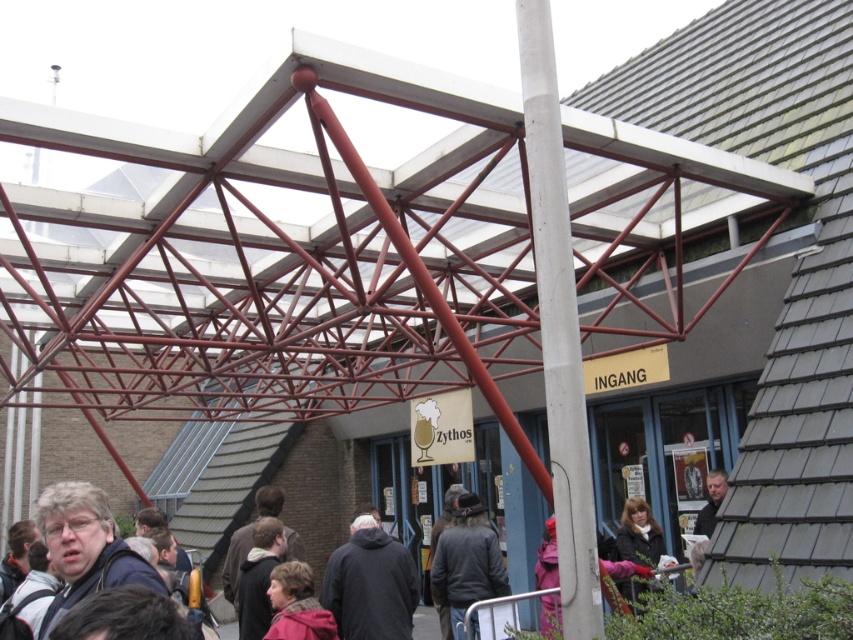
Question: Which point is closer to the camera taking this photo?

Choices:
 (A) coord(352,624)
 (B) coord(281,563)

Answer: (A)

Question: Is dark gray hoodie at center closer to camera compared to dark brown leather jacket at center?

Choices:
 (A) yes
 (B) no

Answer: (A)

Question: Is dark brown leather jacket at center positioned before pink fabric at center?

Choices:
 (A) yes
 (B) no

Answer: (B)

Question: From the image, what is the correct spatial relationship of dark brown leather jacket at center in relation to pink fabric at center?

Choices:
 (A) left
 (B) right

Answer: (B)

Question: Which point is farther to the camera?

Choices:
 (A) (277, 566)
 (B) (326, 582)

Answer: (B)

Question: Which of the following is the farthest from the observer?

Choices:
 (A) (381, 573)
 (B) (276, 579)

Answer: (A)